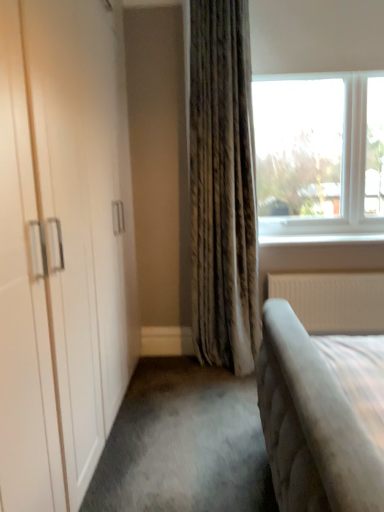
Question: Should I look upward or downward to see clear glass window at upper right?

Choices:
 (A) down
 (B) up

Answer: (B)

Question: Is the depth of clear glass window at upper right less than that of white textured radiator at lower right?

Choices:
 (A) no
 (B) yes

Answer: (B)

Question: Considering the relative sizes of clear glass window at upper right and white textured radiator at lower right in the image provided, is clear glass window at upper right thinner than white textured radiator at lower right?

Choices:
 (A) no
 (B) yes

Answer: (A)

Question: Would you say clear glass window at upper right is a long distance from white textured radiator at lower right?

Choices:
 (A) no
 (B) yes

Answer: (A)

Question: From a real-world perspective, does clear glass window at upper right sit lower than white textured radiator at lower right?

Choices:
 (A) no
 (B) yes

Answer: (A)

Question: Considering the relative sizes of clear glass window at upper right and white textured radiator at lower right in the image provided, is clear glass window at upper right wider than white textured radiator at lower right?

Choices:
 (A) yes
 (B) no

Answer: (A)

Question: Is clear glass window at upper right surrounding white textured radiator at lower right?

Choices:
 (A) yes
 (B) no

Answer: (B)

Question: Is clear glass window at upper right to the left of white glossy window sill at upper right from the viewer's perspective?

Choices:
 (A) no
 (B) yes

Answer: (B)

Question: From a real-world perspective, is clear glass window at upper right beneath white glossy window sill at upper right?

Choices:
 (A) yes
 (B) no

Answer: (B)

Question: Considering the relative sizes of clear glass window at upper right and white glossy window sill at upper right in the image provided, is clear glass window at upper right taller than white glossy window sill at upper right?

Choices:
 (A) no
 (B) yes

Answer: (B)

Question: Considering the relative sizes of clear glass window at upper right and white glossy window sill at upper right in the image provided, is clear glass window at upper right wider than white glossy window sill at upper right?

Choices:
 (A) no
 (B) yes

Answer: (B)

Question: Is the position of clear glass window at upper right less distant than that of white glossy window sill at upper right?

Choices:
 (A) no
 (B) yes

Answer: (B)

Question: From a real-world perspective, is clear glass window at upper right positioned over white glossy window sill at upper right based on gravity?

Choices:
 (A) no
 (B) yes

Answer: (B)

Question: From the image's perspective, is white textured radiator at lower right under white glossy window sill at upper right?

Choices:
 (A) yes
 (B) no

Answer: (A)